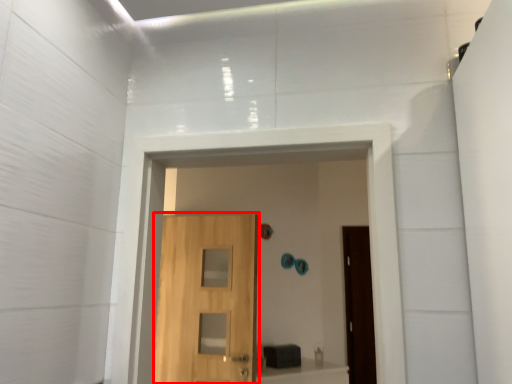
Question: Observing the image, what is the correct spatial positioning of door (annotated by the red box) in reference to passage?

Choices:
 (A) left
 (B) right

Answer: (A)